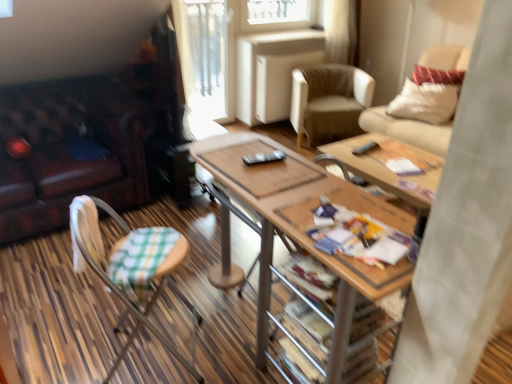
Where is `vacant space situated on the left part of printed paper magazine at center`? This screenshot has height=384, width=512. vacant space situated on the left part of printed paper magazine at center is located at coordinates (308, 233).